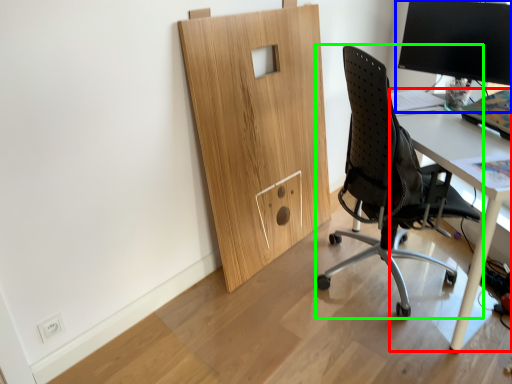
Question: Which is nearer to the desk (highlighted by a red box)? desktop computer (highlighted by a blue box) or chair (highlighted by a green box).

Choices:
 (A) desktop computer
 (B) chair

Answer: (B)